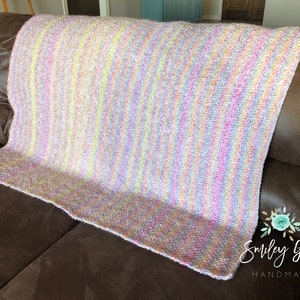
Image resolution: width=300 pixels, height=300 pixels. Find the location of `leather couch`. leather couch is located at coordinates (275, 192).